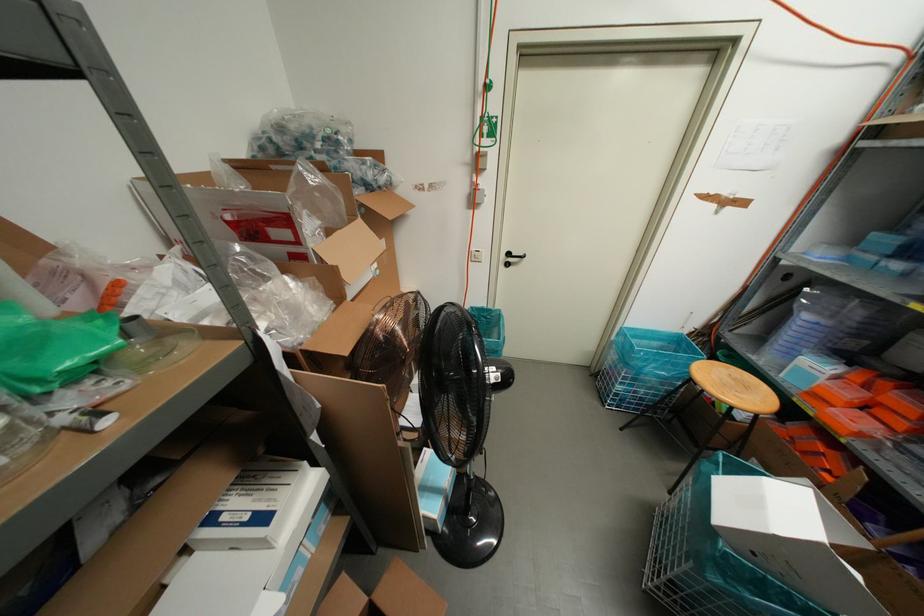
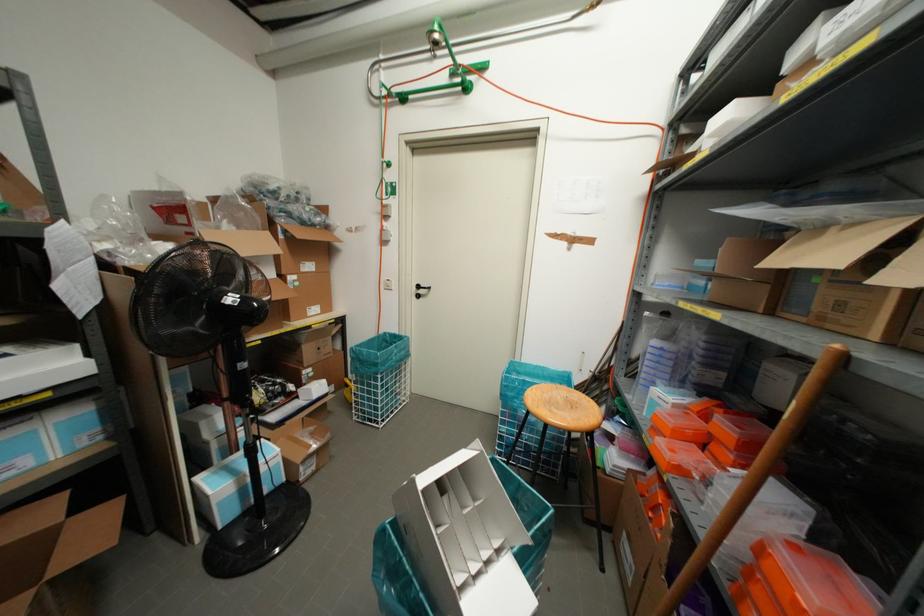
The point at (470, 257) is marked in the first image. Where is the corresponding point in the second image?

(382, 285)